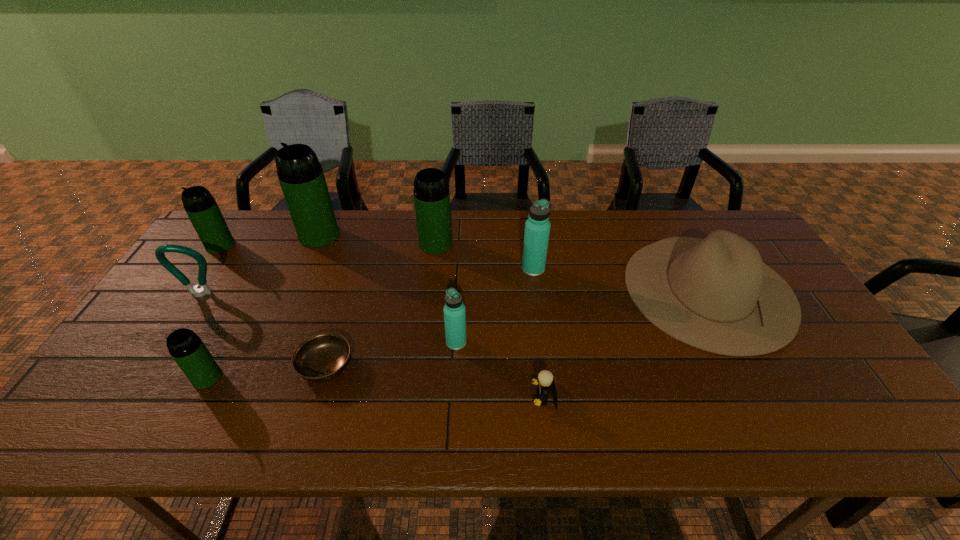
Find the location of `object situated at the near edge`. object situated at the near edge is located at coordinates (545, 381).

The height and width of the screenshot is (540, 960). In order to click on thermos bottle that is at the left edge in this screenshot , I will do `click(200, 206)`.

Locate an element on the screen. This screenshot has width=960, height=540. bottle opener present at the left edge is located at coordinates (160, 250).

Locate an element on the screen. Image resolution: width=960 pixels, height=540 pixels. object located in the right edge section of the desktop is located at coordinates (716, 294).

At what (x,y) coordinates should I click in order to perform the action: click on object located at the far left corner. Please return your answer as a coordinate pair (x, y). Looking at the image, I should click on (200, 206).

You are a GUI agent. You are given a task and a screenshot of the screen. Output one action in this format:
    pyautogui.click(x=<x>, y=<y>)
    Task: Click on the object that is at the far right corner
    
    Given the screenshot: What is the action you would take?
    pyautogui.click(x=716, y=294)

The height and width of the screenshot is (540, 960). What are the coordinates of `vacant space at the far edge of the desktop` in the screenshot? It's located at (489, 240).

In the image, there is a desktop. Where is `vacant region at the near edge`? The width and height of the screenshot is (960, 540). vacant region at the near edge is located at coordinates (200, 426).

Locate an element on the screen. The image size is (960, 540). vacant space at the left edge of the desktop is located at coordinates (182, 309).

The image size is (960, 540). What are the coordinates of `vacant space at the near right corner of the desktop` in the screenshot? It's located at (890, 441).